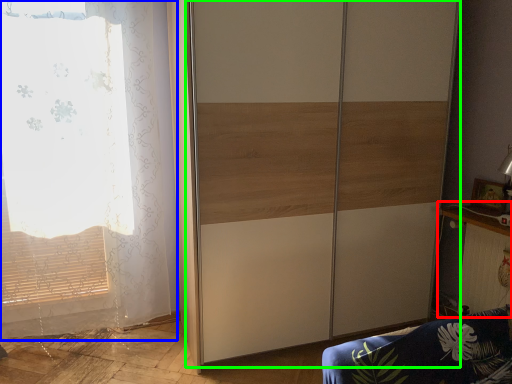
Question: Estimate the real-world distances between objects in this image. Which object is farther from table (highlighted by a red box), curtain (highlighted by a blue box) or screen door (highlighted by a green box)?

Choices:
 (A) curtain
 (B) screen door

Answer: (A)